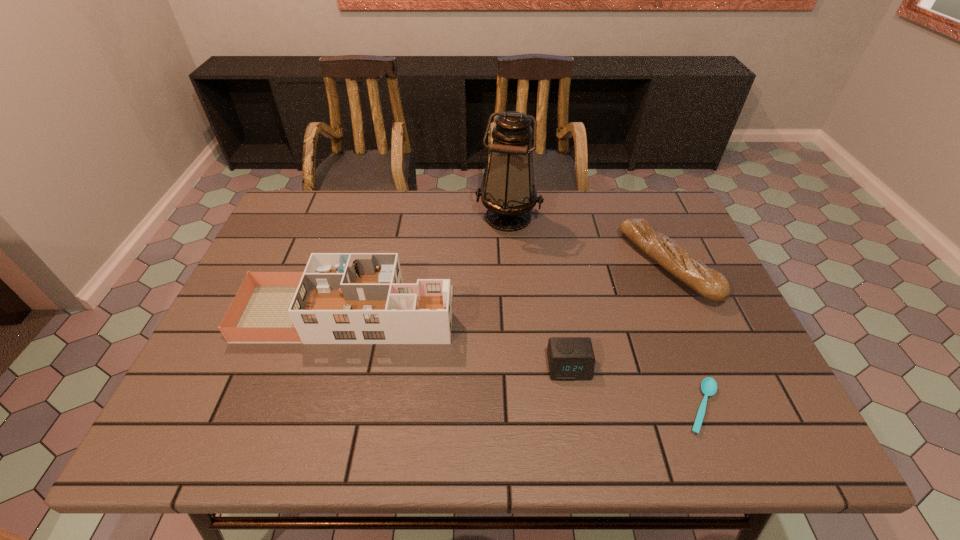
What are the coordinates of `the tallest object` in the screenshot? It's located at (509, 194).

Identify the location of the leftmost object. Image resolution: width=960 pixels, height=540 pixels. (341, 298).

Locate an element on the screen. This screenshot has width=960, height=540. dollhouse is located at coordinates tap(341, 298).

Identify the location of the third tallest object. (709, 283).

Locate an element on the screen. The image size is (960, 540). the second shortest object is located at coordinates (569, 358).

What are the coordinates of `spoon` in the screenshot? It's located at (708, 386).

Where is `vacant space located 0.180m on the left of the tallest object`? This screenshot has width=960, height=540. vacant space located 0.180m on the left of the tallest object is located at coordinates (418, 218).

I want to click on blank space located at the front door of the second tallest object, so click(x=532, y=313).

Locate an element on the screen. free space located 0.310m on the front of the third shortest object is located at coordinates (736, 427).

Locate an element on the screen. free spot located 0.150m on the front-facing side of the fourth tallest object is located at coordinates (583, 448).